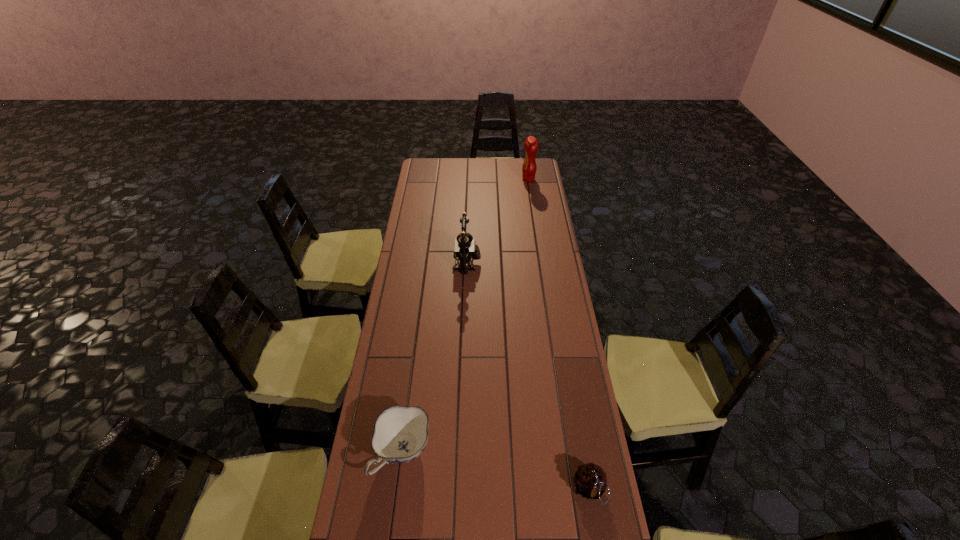
Where is `the second closest object to the telephone`? This screenshot has width=960, height=540. the second closest object to the telephone is located at coordinates (400, 435).

Where is `vacant area in the image that satisfies the following two spatial constraints: 1. on the rotary dial of the second farthest object; 2. on the front side of the chinaware`? The height and width of the screenshot is (540, 960). vacant area in the image that satisfies the following two spatial constraints: 1. on the rotary dial of the second farthest object; 2. on the front side of the chinaware is located at coordinates (461, 453).

The image size is (960, 540). Find the location of `vacant space that satisfies the following two spatial constraints: 1. on the label side of the condiment; 2. on the front side of the chinaware`. vacant space that satisfies the following two spatial constraints: 1. on the label side of the condiment; 2. on the front side of the chinaware is located at coordinates (569, 453).